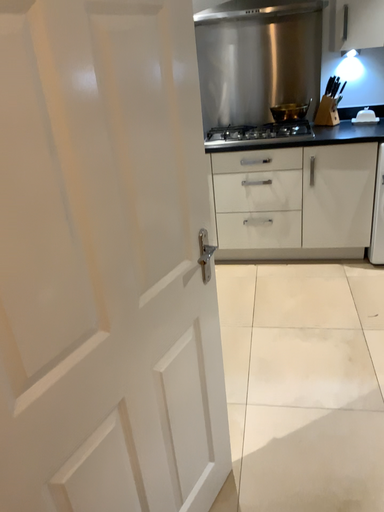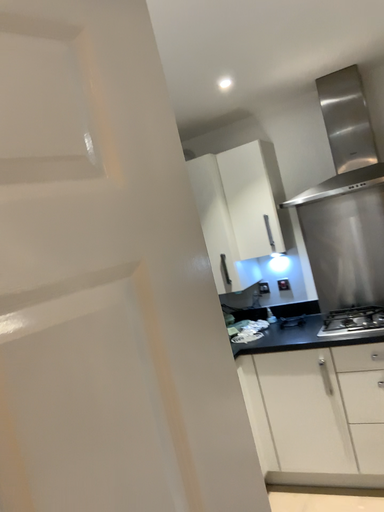
Question: How did the camera likely rotate when shooting the video?

Choices:
 (A) rotated left
 (B) rotated right

Answer: (A)